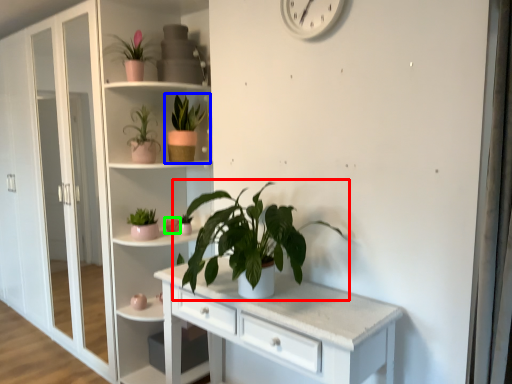
Question: Which object is the farthest from houseplant (highlighted by a red box)? Choose among these: houseplant (highlighted by a blue box) or flower (highlighted by a green box).

Choices:
 (A) houseplant
 (B) flower

Answer: (A)